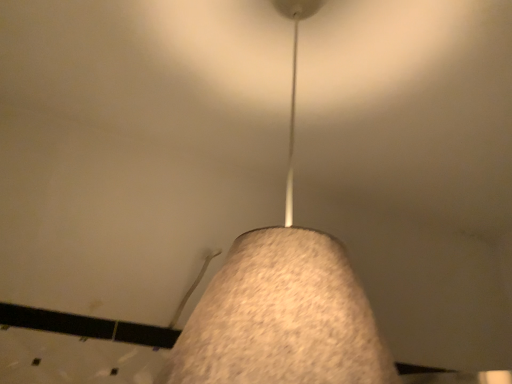
The image size is (512, 384). In order to click on speckled fabric lampshade at center in this screenshot , I will do [283, 301].

This screenshot has height=384, width=512. Describe the element at coordinates (283, 301) in the screenshot. I see `speckled fabric lampshade at center` at that location.

Measure the distance between point (280,333) and camera.

Point (280,333) and camera are 14.25 inches apart.

The image size is (512, 384). Find the location of `speckled fabric lampshade at center`. speckled fabric lampshade at center is located at coordinates (283, 301).